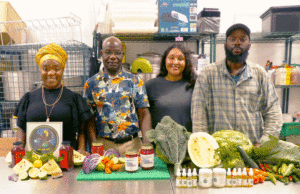
Find the location of a particular element. bottles is located at coordinates (245, 174), (235, 179), (192, 177).